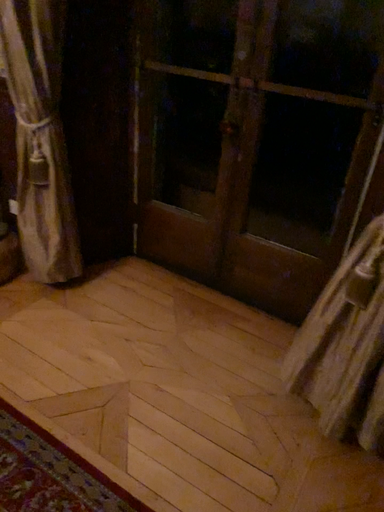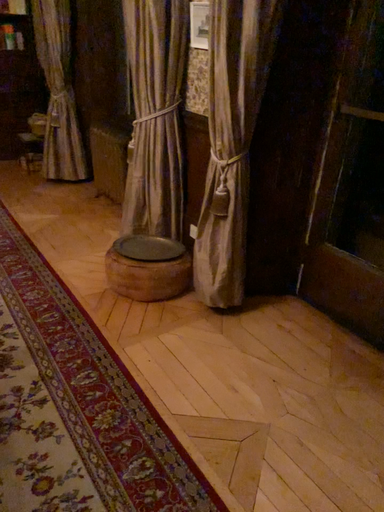
Question: Which way did the camera rotate in the video?

Choices:
 (A) rotated downward
 (B) rotated upward

Answer: (B)